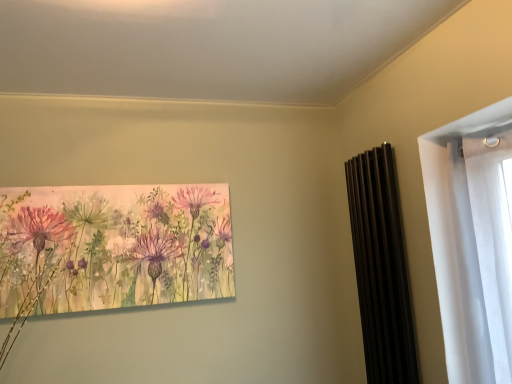
Question: Considering their positions, is black matte radiator at right located in front of or behind watercolor painting of flowers at center?

Choices:
 (A) behind
 (B) front

Answer: (B)

Question: Is black matte radiator at right wider or thinner than watercolor painting of flowers at center?

Choices:
 (A) wide
 (B) thin

Answer: (A)

Question: Which is correct: black matte radiator at right is inside watercolor painting of flowers at center, or outside of it?

Choices:
 (A) outside
 (B) inside

Answer: (A)

Question: Looking at their shapes, would you say watercolor painting of flowers at center is wider or thinner than black matte radiator at right?

Choices:
 (A) wide
 (B) thin

Answer: (B)

Question: Considering the positions of point (182, 238) and point (347, 195), is point (182, 238) closer or farther from the camera than point (347, 195)?

Choices:
 (A) farther
 (B) closer

Answer: (B)

Question: In the image, is watercolor painting of flowers at center positioned in front of or behind black matte radiator at right?

Choices:
 (A) behind
 (B) front

Answer: (A)

Question: Based on their sizes in the image, would you say watercolor painting of flowers at center is bigger or smaller than black matte radiator at right?

Choices:
 (A) big
 (B) small

Answer: (B)